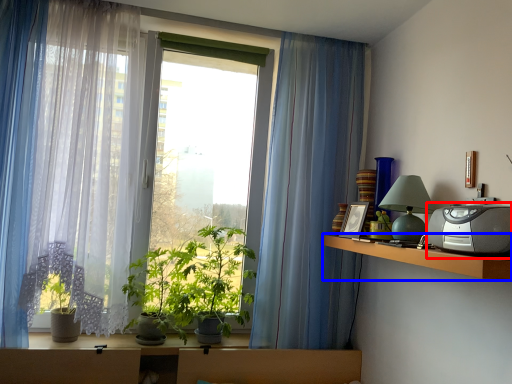
Question: Which point is closer to the camera, appliance (highlighted by a red box) or shelf (highlighted by a blue box)?

Choices:
 (A) appliance
 (B) shelf

Answer: (A)